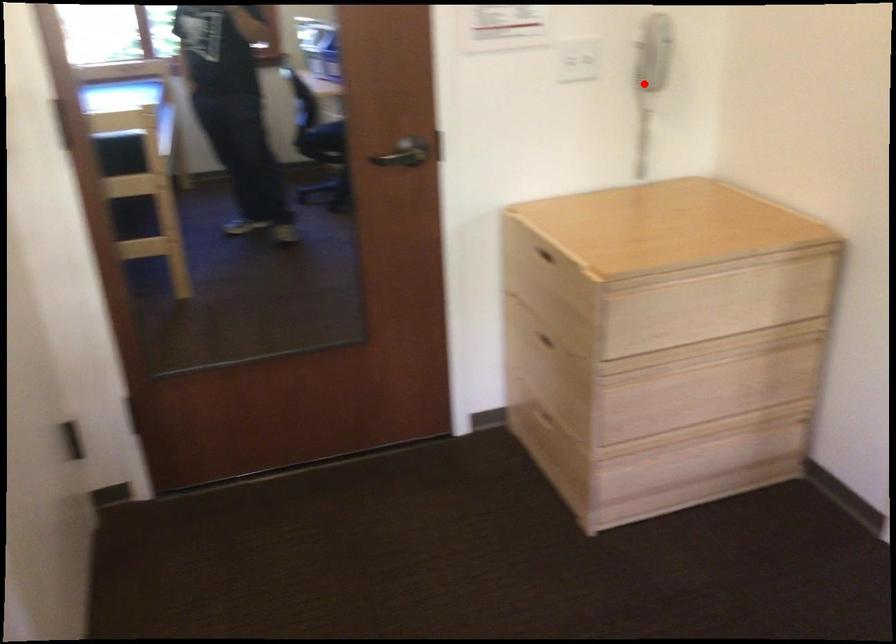
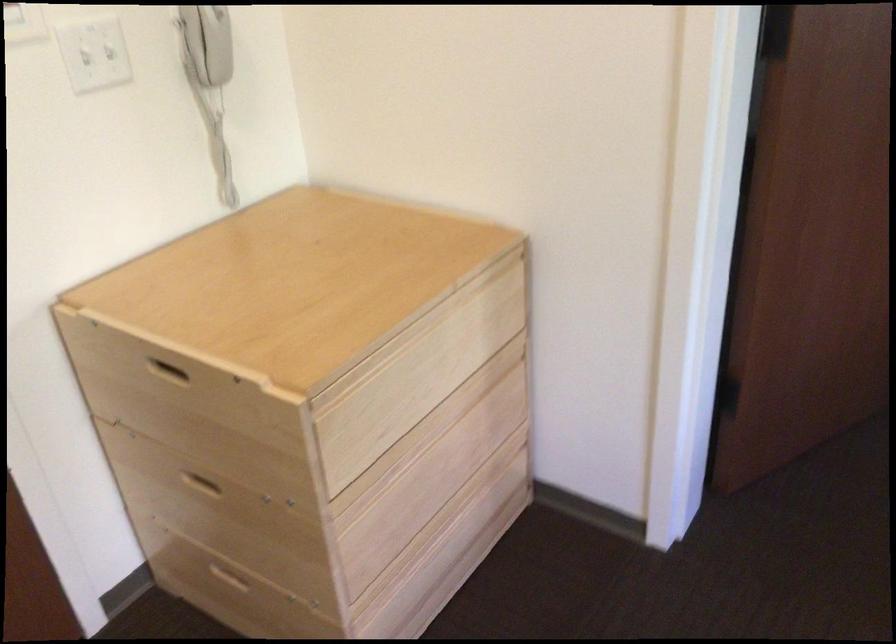
Question: I am providing you with two images of the same scene from different viewpoints. Given a red point in image1, look at the same physical point in image2. Is it:

Choices:
 (A) Closer to the viewpoint
 (B) Farther from the viewpoint

Answer: (A)